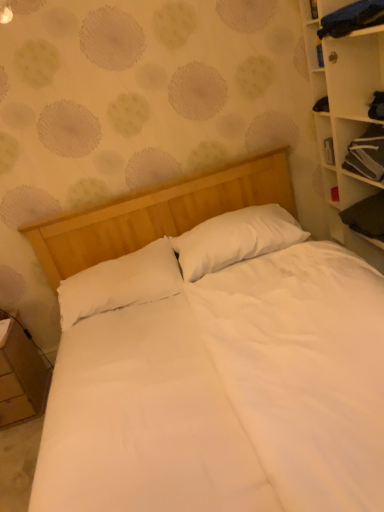
Question: Relative to white soft pillow at center, arranged as the 2th pillow when viewed from the right, is wooden nightstand at lower left in front or behind?

Choices:
 (A) front
 (B) behind

Answer: (B)

Question: From the image's perspective, is wooden nightstand at lower left located above or below white soft pillow at center, placed as the first pillow when sorted from left to right?

Choices:
 (A) below
 (B) above

Answer: (A)

Question: Based on their relative distances, which object is farther from the black fabric cabinet at upper right?

Choices:
 (A) wooden nightstand at lower left
 (B) white soft pillow at center, arranged as the 2th pillow when viewed from the left
 (C) white wood bookcase at right
 (D) white soft pillow at center, placed as the first pillow when sorted from left to right

Answer: (A)

Question: Estimate the real-world distances between objects in this image. Which object is farther from the wooden nightstand at lower left?

Choices:
 (A) white wood bookcase at right
 (B) black fabric cabinet at upper right
 (C) white soft pillow at center, arranged as the 2th pillow when viewed from the left
 (D) white soft pillow at center, placed as the first pillow when sorted from left to right

Answer: (B)